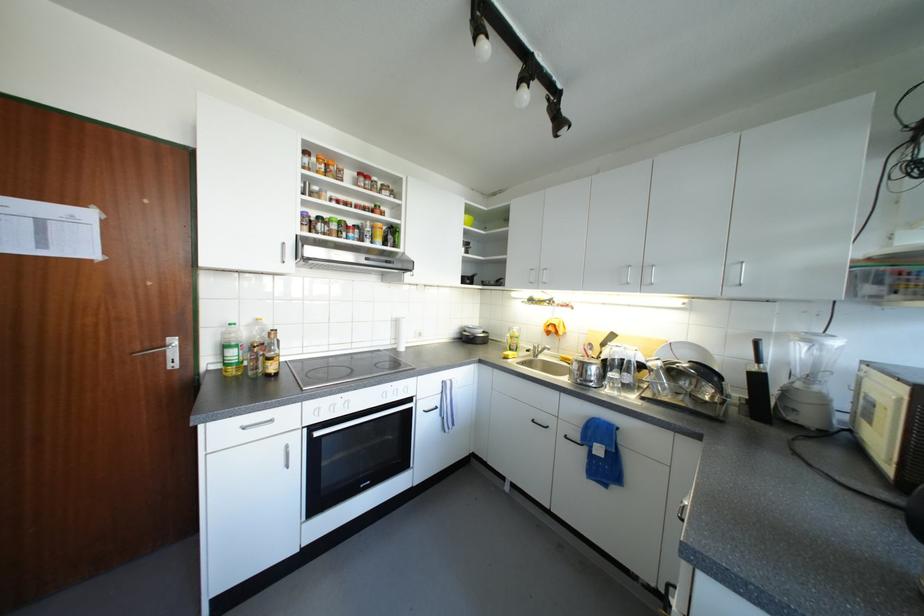
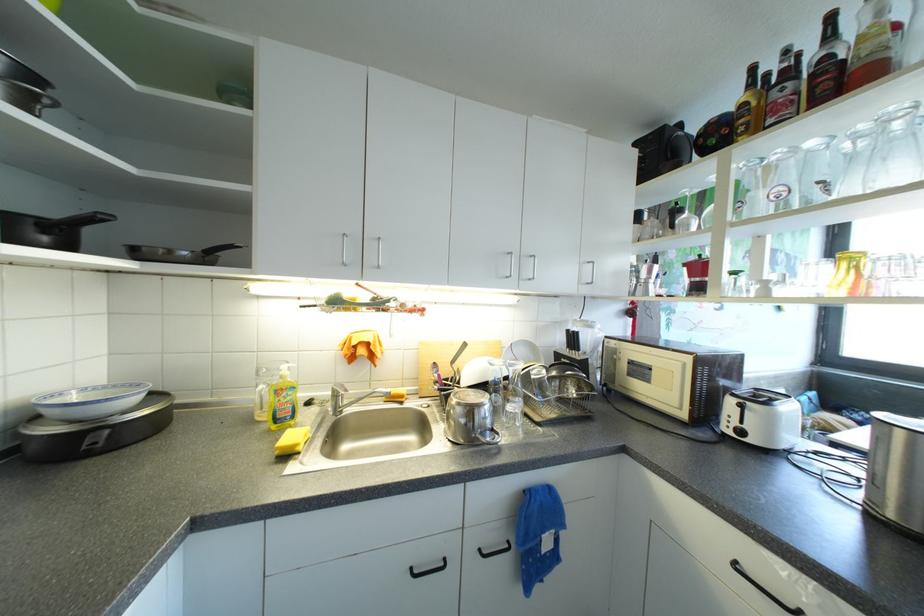
Find the pixel in the second image that matches (x=472, y=331) in the first image.

(55, 413)